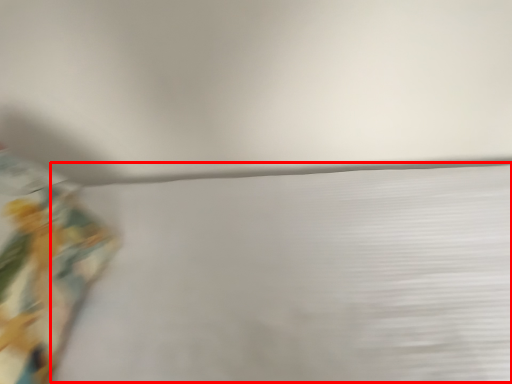
Question: From the image's perspective, where is sheet (annotated by the red box) located in relation to curtain in the image?

Choices:
 (A) above
 (B) below

Answer: (A)